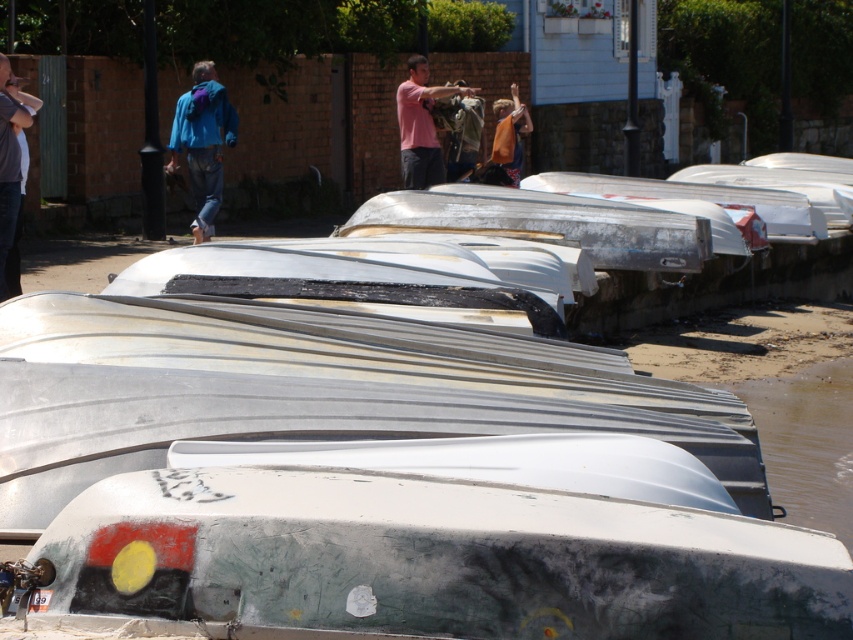
Question: Does matte blue jacket at left have a smaller size compared to brushed metal jacket at upper left?

Choices:
 (A) yes
 (B) no

Answer: (B)

Question: Considering the real-world distances, which object is closest to the matte blue jacket at left?

Choices:
 (A) brushed metal jacket at upper left
 (B) pink matte shirt at center
 (C) matte black jacket at center
 (D) orange fabric bag at center

Answer: (B)

Question: Which point appears closest to the camera in this image?

Choices:
 (A) (445, 109)
 (B) (497, 129)
 (C) (189, 148)
 (D) (27, 113)

Answer: (D)

Question: Does pink matte shirt at center have a greater width compared to matte black jacket at center?

Choices:
 (A) no
 (B) yes

Answer: (B)

Question: Estimate the real-world distances between objects in this image. Which object is farther from the pink matte shirt at center?

Choices:
 (A) matte black jacket at center
 (B) white matte boat at center
 (C) brushed metal jacket at upper left
 (D) matte blue jacket at left

Answer: (B)

Question: Does white matte boat at center have a greater width compared to orange fabric bag at center?

Choices:
 (A) no
 (B) yes

Answer: (B)